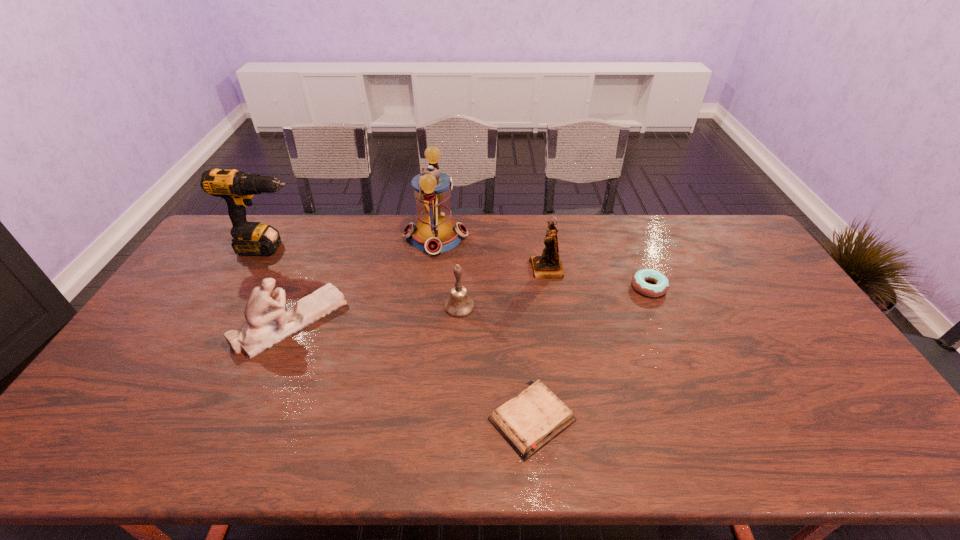
The width and height of the screenshot is (960, 540). I want to click on lantern, so click(435, 232).

At what (x,y) coordinates should I click in order to perform the action: click on drill. Please return your answer as a coordinate pair (x, y). The width and height of the screenshot is (960, 540). Looking at the image, I should click on (237, 188).

The width and height of the screenshot is (960, 540). What are the coordinates of `the right figurine` in the screenshot? It's located at (548, 265).

The height and width of the screenshot is (540, 960). Find the location of `the shorter figurine`. the shorter figurine is located at coordinates (268, 324).

Locate an element on the screen. The width and height of the screenshot is (960, 540). the left figurine is located at coordinates (268, 324).

What are the coordinates of `bell` in the screenshot? It's located at click(x=459, y=304).

Image resolution: width=960 pixels, height=540 pixels. In order to click on the rightmost object in this screenshot , I will do click(638, 280).

Locate an element on the screen. the second shortest object is located at coordinates (638, 280).

You are a GUI agent. You are given a task and a screenshot of the screen. Output one action in this format:
    pyautogui.click(x=<x>, y=<y>)
    Task: Click on the diary
    This screenshot has height=540, width=960.
    Given the screenshot: What is the action you would take?
    pyautogui.click(x=527, y=422)

At what (x,y) coordinates should I click in order to perform the action: click on the shortest object. Please return your answer as a coordinate pair (x, y). This screenshot has width=960, height=540. Looking at the image, I should click on (527, 422).